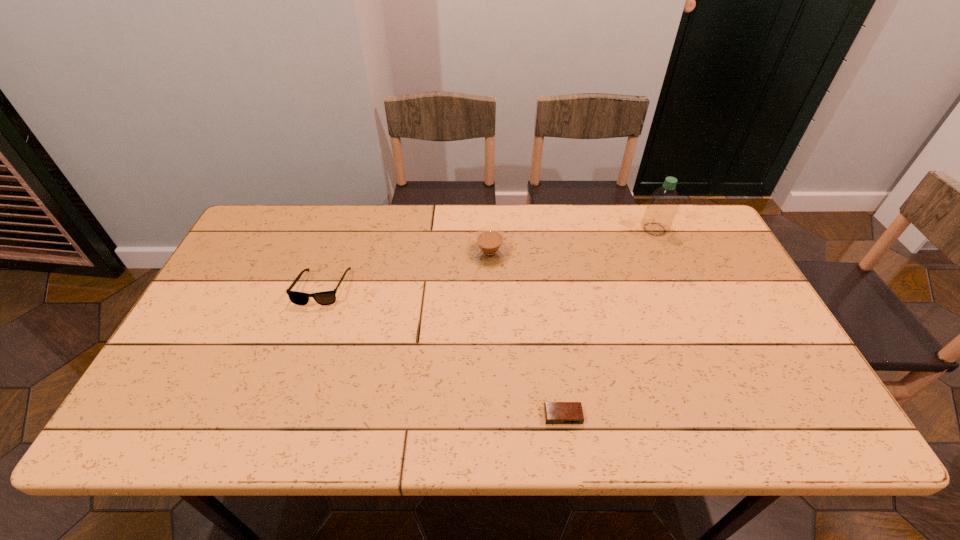
What are the coordinates of `the tallest object` in the screenshot? It's located at (663, 204).

You are a GUI agent. You are given a task and a screenshot of the screen. Output one action in this format:
    pyautogui.click(x=<x>, y=<y>)
    Task: Click on the rightmost object
    The width and height of the screenshot is (960, 540).
    Given the screenshot: What is the action you would take?
    pyautogui.click(x=663, y=204)

Where is `the third shortest object`? The image size is (960, 540). the third shortest object is located at coordinates (489, 248).

The width and height of the screenshot is (960, 540). What are the coordinates of `cappuccino` in the screenshot? It's located at (489, 248).

At what (x,y) coordinates should I click in order to perform the action: click on the leftmost object. Please return your answer as a coordinate pair (x, y). The image size is (960, 540). Looking at the image, I should click on (326, 297).

Find the location of a particular element. The width and height of the screenshot is (960, 540). the third tallest object is located at coordinates (326, 297).

Identify the location of the third object from left to right. The width and height of the screenshot is (960, 540). (555, 412).

Image resolution: width=960 pixels, height=540 pixels. What are the coordinates of `the shortest object` in the screenshot? It's located at (555, 412).

The height and width of the screenshot is (540, 960). In order to click on free spot located 0.360m on the front of the farthest object in this screenshot , I will do `click(698, 327)`.

I want to click on vacant space positioned on the left of the second object from left to right, so click(x=341, y=253).